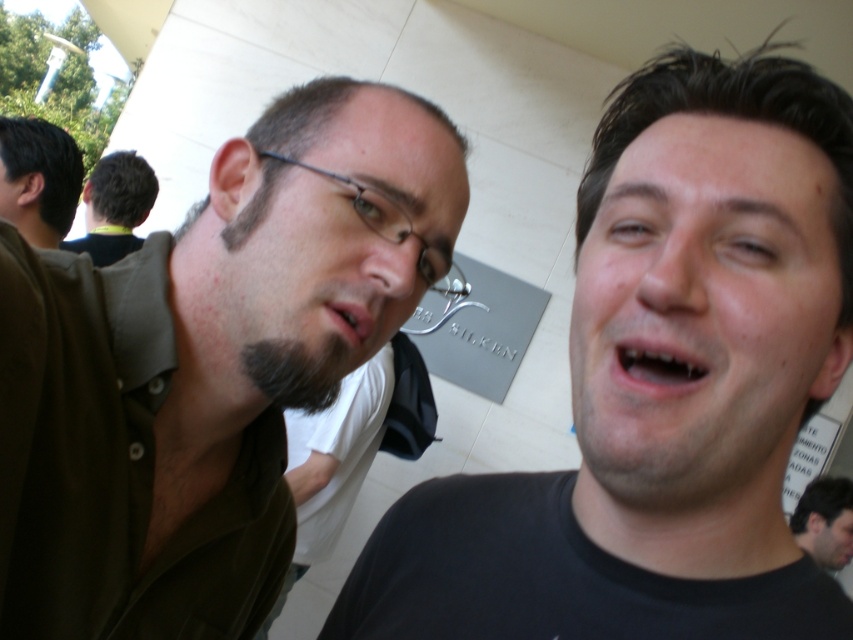
Question: Can you confirm if matte skin mouth at center is smaller than smooth skin face at center?

Choices:
 (A) no
 (B) yes

Answer: (B)

Question: Which is nearer to the dark brown hair at left?

Choices:
 (A) dark brown hair at lower right
 (B) black matte shirt at upper right
 (C) smooth skin face at center

Answer: (B)

Question: Can you confirm if smooth skin face at right is positioned below matte skin mouth at center?

Choices:
 (A) no
 (B) yes

Answer: (A)

Question: Which of the following is the closest to the observer?

Choices:
 (A) smooth skin face at center
 (B) dark brown hair at upper left
 (C) green matte shirt at left
 (D) matte black glasses at center

Answer: (C)

Question: Among these objects, which one is nearest to the camera?

Choices:
 (A) dark brown hair at left
 (B) green matte shirt at left

Answer: (B)

Question: Observing the image, what is the correct spatial positioning of smooth skin face at right in reference to matte skin mouth at center?

Choices:
 (A) below
 (B) above

Answer: (B)